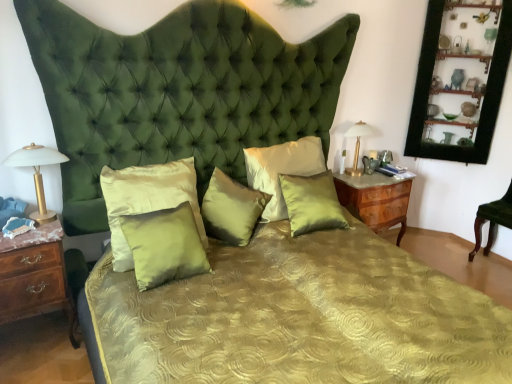
At what (x,y) coordinates should I click in order to perform the action: click on vacant space in front of gold metallic lamp at right, acting as the 1th bedside lamp starting from the right. Please return your answer as a coordinate pair (x, y). This screenshot has width=512, height=384. Looking at the image, I should click on (362, 181).